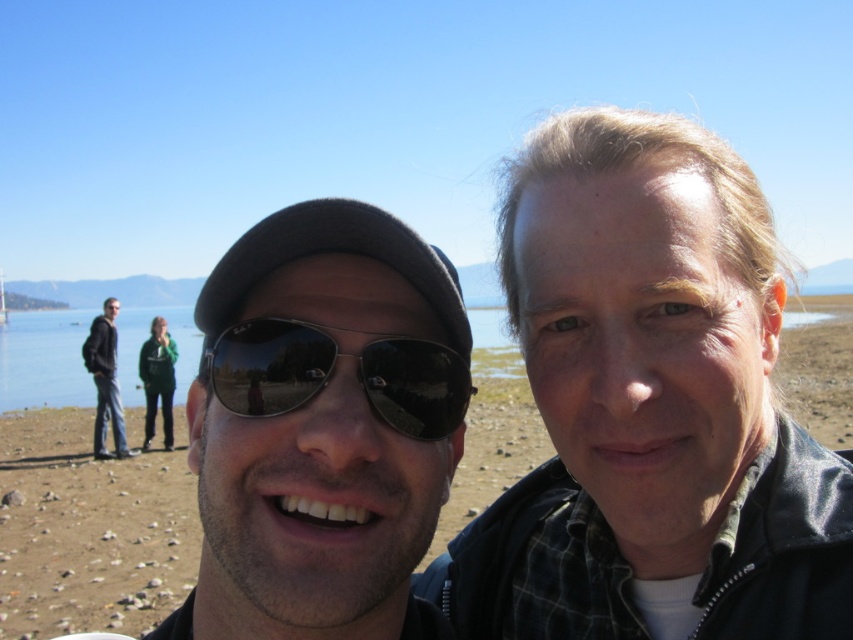
Is point (422, 296) more distant than point (262, 397)?

Yes, point (422, 296) is farther from viewer.

Is matte black sunglasses at center above black reflective sunglasses at center?

Actually, matte black sunglasses at center is below black reflective sunglasses at center.

What do you see at coordinates (322, 426) in the screenshot?
I see `matte black sunglasses at center` at bounding box center [322, 426].

The width and height of the screenshot is (853, 640). I want to click on matte black sunglasses at center, so [x=322, y=426].

Does brown sand at center have a lesser width compared to clear blue water at center?

In fact, brown sand at center might be wider than clear blue water at center.

Can you confirm if brown sand at center is positioned below clear blue water at center?

Yes, brown sand at center is below clear blue water at center.

Is point (117, 508) behind point (32, 312)?

That is False.

You are a GUI agent. You are given a task and a screenshot of the screen. Output one action in this format:
    pyautogui.click(x=<x>, y=<y>)
    Task: Click on the brown sand at center
    
    Given the screenshot: What is the action you would take?
    pyautogui.click(x=90, y=529)

Can you confirm if brown sand at center is shorter than black reflective sunglasses at center?

No.

Between brown sand at center and black reflective sunglasses at center, which one is positioned lower?

Positioned lower is black reflective sunglasses at center.

At what (x,y) coordinates should I click in order to perform the action: click on brown sand at center. Please return your answer as a coordinate pair (x, y). The width and height of the screenshot is (853, 640). Looking at the image, I should click on (90, 529).